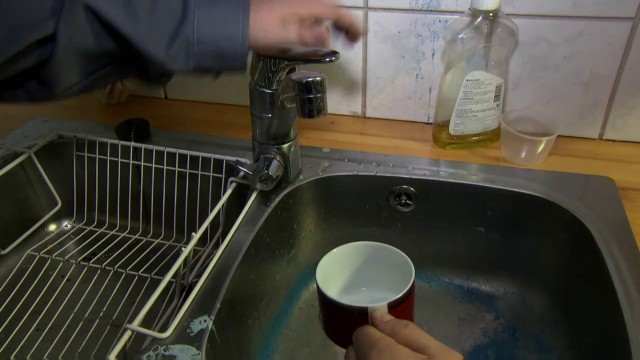
The width and height of the screenshot is (640, 360). Identify the location of cup. (353, 279).